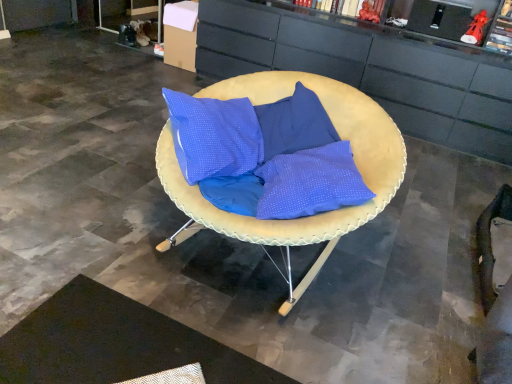
Identify the location of matte black cabinet at center. This screenshot has width=512, height=384. (370, 69).

Is matte yellow cushion at center at the left side of matte black cabinet at center?

Yes, matte yellow cushion at center is to the left of matte black cabinet at center.

Are matte yellow cushion at center and matte black cabinet at center far apart?

That's right, there is a large distance between matte yellow cushion at center and matte black cabinet at center.

Which object is further away from the camera, matte yellow cushion at center or matte black cabinet at center?

matte black cabinet at center.

Is black textured mat at lower left aimed at matte black cabinet at center?

Yes, black textured mat at lower left faces towards matte black cabinet at center.

Consider the image. Who is smaller, black textured mat at lower left or matte black cabinet at center?

black textured mat at lower left is smaller.

Does black textured mat at lower left touch matte black cabinet at center?

No, black textured mat at lower left is not in contact with matte black cabinet at center.

Who is smaller, black textured mat at lower left or matte yellow cushion at center?

black textured mat at lower left.

From a real-world perspective, relative to matte yellow cushion at center, is black textured mat at lower left vertically above or below?

In terms of real-world spatial position, black textured mat at lower left is below matte yellow cushion at center.

Is black textured mat at lower left at the left side of matte yellow cushion at center?

Yes.

How distant is black textured mat at lower left from matte yellow cushion at center?

black textured mat at lower left is 27.78 inches from matte yellow cushion at center.

How much distance is there between matte yellow cushion at center and black textured mat at lower left?

matte yellow cushion at center and black textured mat at lower left are 27.78 inches apart.

Does point (355, 162) appear closer or farther from the camera than point (201, 364)?

Clearly, point (355, 162) is more distant from the camera than point (201, 364).

Is matte yellow cushion at center at the right side of black textured mat at lower left?

Yes.

Is matte yellow cushion at center aimed at black textured mat at lower left?

Yes.

Is matte black cabinet at center touching black textured mat at lower left?

There is a gap between matte black cabinet at center and black textured mat at lower left.

From the image's perspective, does matte black cabinet at center appear higher than black textured mat at lower left?

Indeed, from the image's perspective, matte black cabinet at center is shown above black textured mat at lower left.

How different are the orientations of matte black cabinet at center and black textured mat at lower left in degrees?

180 degrees.

Does matte black cabinet at center have a lesser height compared to matte yellow cushion at center?

In fact, matte black cabinet at center may be taller than matte yellow cushion at center.

Is matte black cabinet at center looking in the opposite direction of matte yellow cushion at center?

No, matte black cabinet at center is not facing the opposite direction of matte yellow cushion at center.

Are matte black cabinet at center and matte yellow cushion at center far apart?

Yes, matte black cabinet at center is far from matte yellow cushion at center.

Where is `chair below the matte black cabinet at center (from a real-world perspective)`? The image size is (512, 384). chair below the matte black cabinet at center (from a real-world perspective) is located at coordinates (305, 217).

Where is `mat in front of the matte black cabinet at center`? The image size is (512, 384). mat in front of the matte black cabinet at center is located at coordinates (114, 343).

Estimate the real-world distances between objects in this image. Which object is further from matte yellow cushion at center, matte black cabinet at center or black textured mat at lower left?

matte black cabinet at center is further to matte yellow cushion at center.

From the image, which object appears to be farther from matte black cabinet at center, black textured mat at lower left or matte yellow cushion at center?

black textured mat at lower left.

Estimate the real-world distances between objects in this image. Which object is closer to matte black cabinet at center, matte yellow cushion at center or black textured mat at lower left?

matte yellow cushion at center.

Considering their positions, is matte black cabinet at center positioned closer to black textured mat at lower left than matte yellow cushion at center?

The object closer to black textured mat at lower left is matte yellow cushion at center.

Considering their positions, is matte yellow cushion at center positioned closer to black textured mat at lower left than matte black cabinet at center?

matte yellow cushion at center lies closer to black textured mat at lower left than the other object.

Based on the photo, when comparing their distances from matte yellow cushion at center, does black textured mat at lower left or matte black cabinet at center seem further?

The object further to matte yellow cushion at center is matte black cabinet at center.

I want to click on chair that lies between matte black cabinet at center and black textured mat at lower left from top to bottom, so click(305, 217).